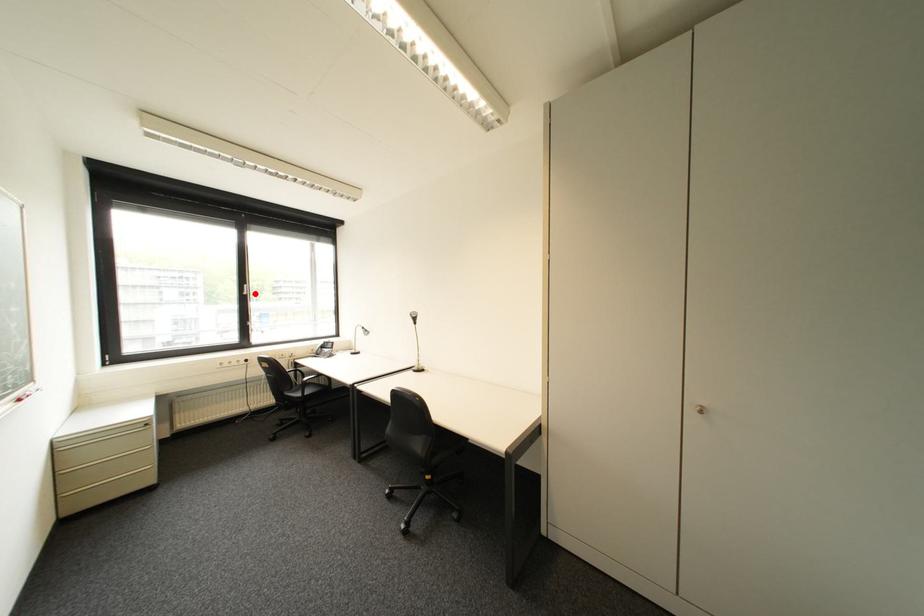
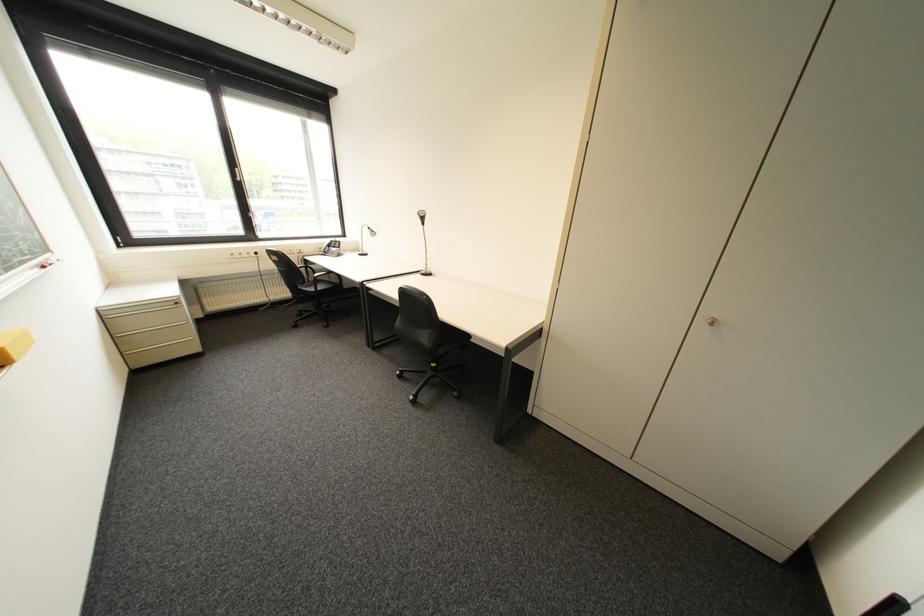
Locate, in the second image, the point that corresponds to the highlighted location in the first image.

(249, 180)